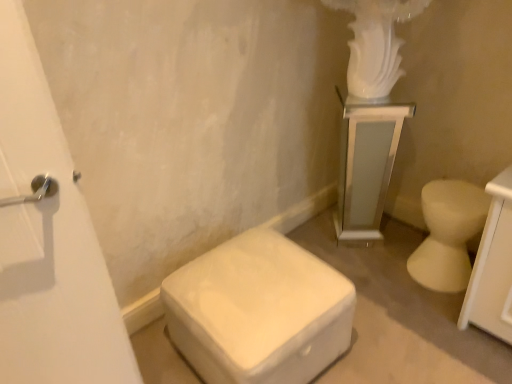
Question: Do you think white matte ottoman at lower center, which ranks as the first toilet in left-to-right order, is within white glossy pedestal at upper right, or outside of it?

Choices:
 (A) outside
 (B) inside

Answer: (A)

Question: Looking at their shapes, would you say white matte ottoman at lower center, which ranks as the first toilet in left-to-right order, is wider or thinner than white glossy pedestal at upper right?

Choices:
 (A) thin
 (B) wide

Answer: (B)

Question: Which object is the farthest from the white glossy pedestal at upper right?

Choices:
 (A) white matte ottoman at lower center, which ranks as the 2th toilet in right-to-left order
 (B) white glossy toilet at right, the 2th toilet positioned from the left

Answer: (A)

Question: Which of these objects is positioned closest to the white glossy toilet at right, the 2th toilet positioned from the left?

Choices:
 (A) white matte ottoman at lower center, which ranks as the 2th toilet in right-to-left order
 (B) white glossy pedestal at upper right

Answer: (B)